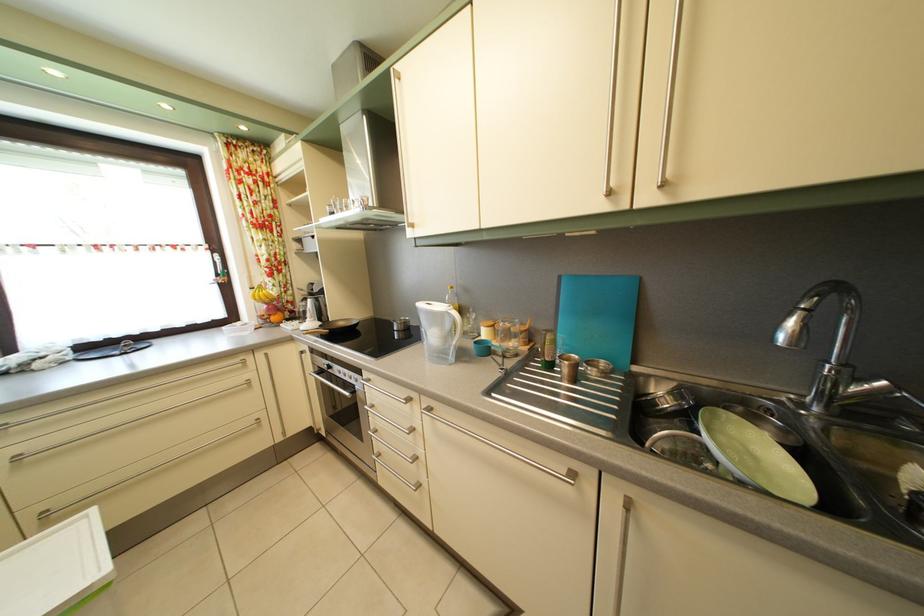
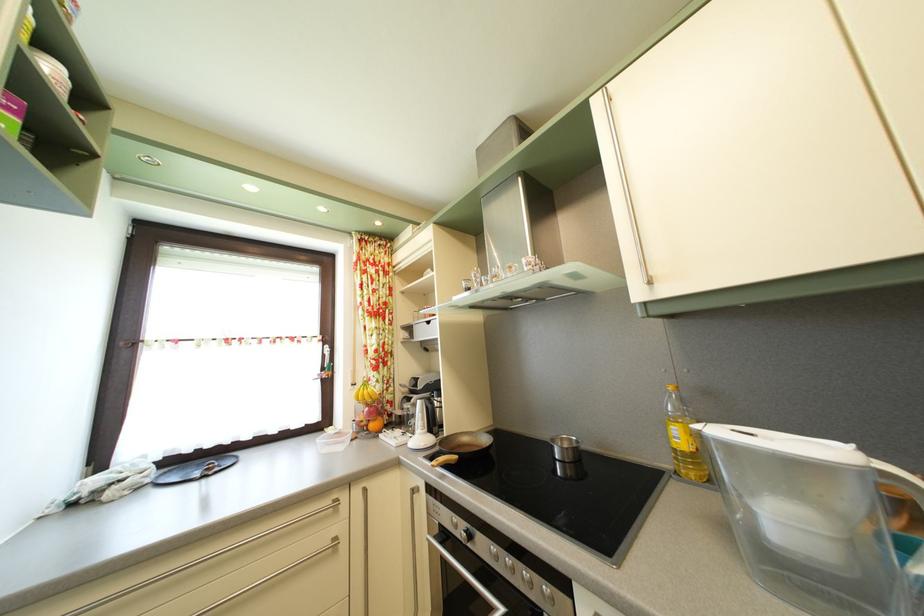
Find the pixel in the second image that matches pixel 473 298 in the first image.

(715, 400)